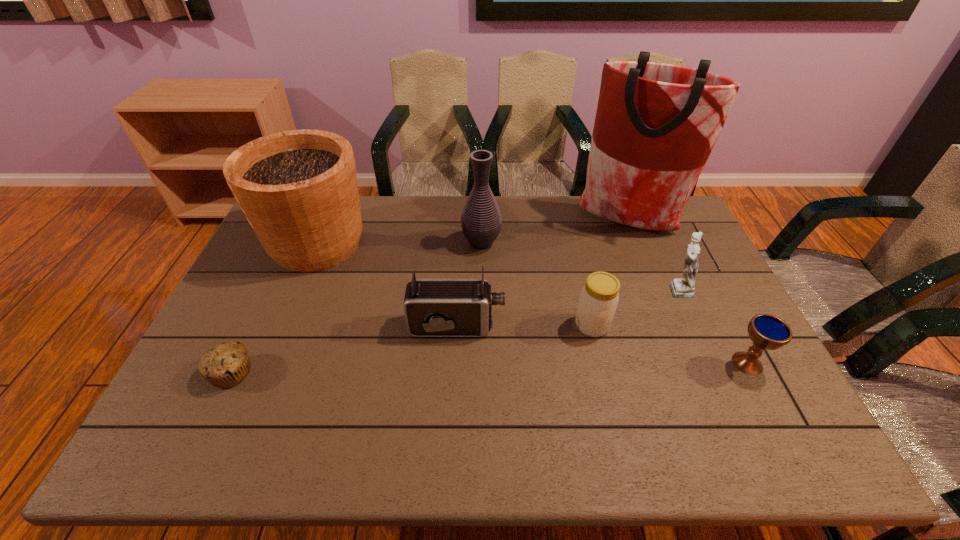
At what (x,y) coordinates should I click in order to perform the action: click on the tallest object. Please return your answer as a coordinate pair (x, y). The width and height of the screenshot is (960, 540). Looking at the image, I should click on (656, 124).

In order to click on vase in this screenshot , I will do coord(481,221).

Locate an element on the screen. flowerpot is located at coordinates (298, 189).

Identify the location of figurine. (683, 288).

The width and height of the screenshot is (960, 540). In order to click on camcorder in this screenshot , I will do `click(433, 307)`.

The width and height of the screenshot is (960, 540). Find the location of `jar`. jar is located at coordinates (599, 298).

What are the coordinates of `the seventh tallest object` in the screenshot? It's located at (766, 331).

Where is `the shortest object`? Image resolution: width=960 pixels, height=540 pixels. the shortest object is located at coordinates (227, 364).

Where is `free space located on the front of the grocery bag`? free space located on the front of the grocery bag is located at coordinates (669, 328).

The image size is (960, 540). I want to click on free space located 0.400m on the right of the vase, so click(619, 243).